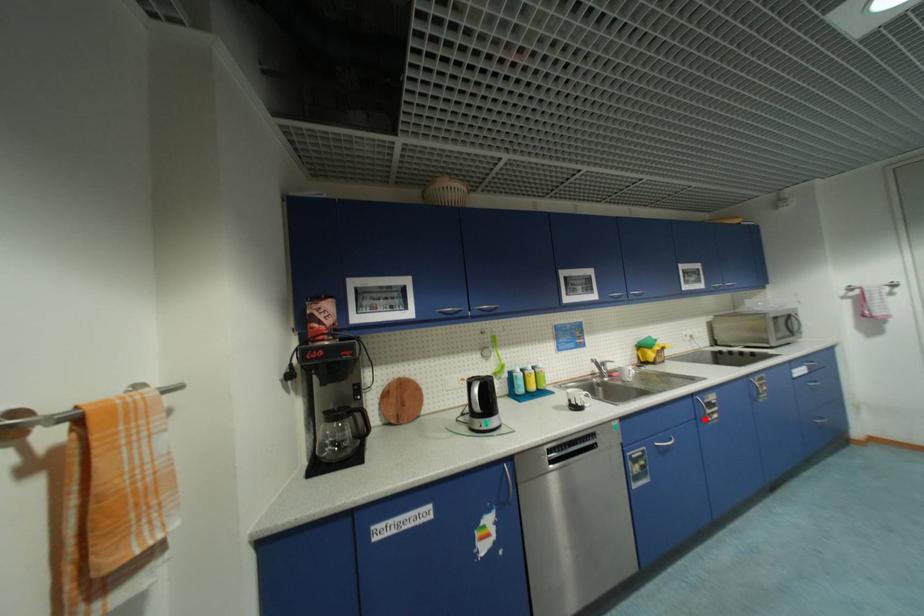
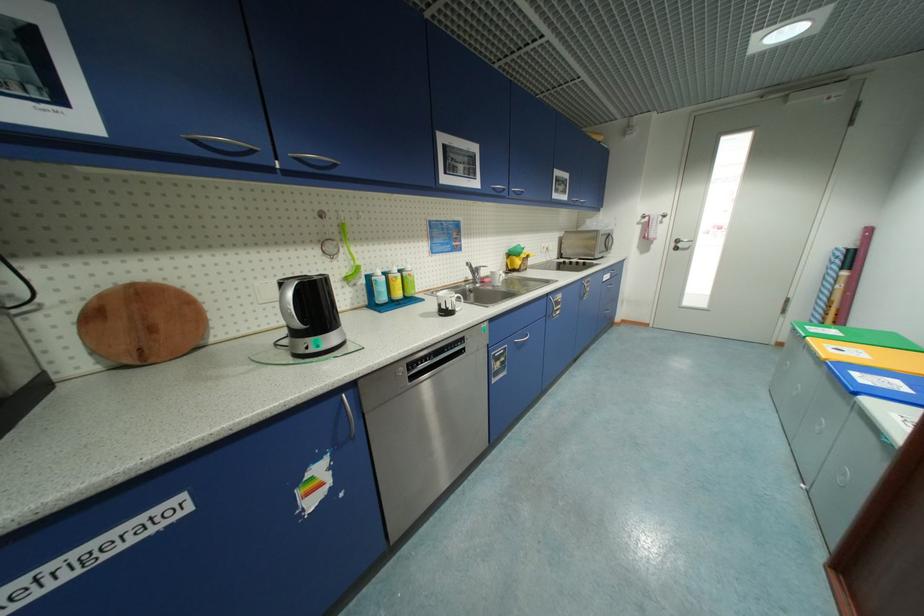
Question: I am providing you with two images of the same scene from different viewpoints. A red point is shown in image1. For the corresponding object point in image2, is it positioned nearer or farther from the camera?

Choices:
 (A) Nearer
 (B) Farther

Answer: (B)